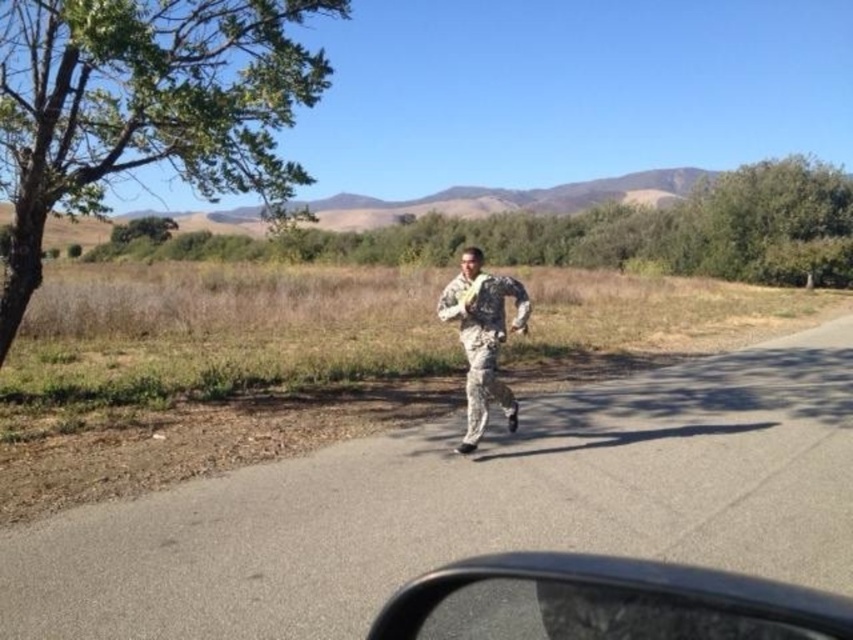
Who is shorter, transparent plastic car window at lower center or camouflage fabric soldier at center?

With less height is transparent plastic car window at lower center.

Between transparent plastic car window at lower center and camouflage fabric soldier at center, which one appears on the right side from the viewer's perspective?

transparent plastic car window at lower center

At what (x,y) coordinates should I click in order to perform the action: click on transparent plastic car window at lower center. Please return your answer as a coordinate pair (x, y). Image resolution: width=853 pixels, height=640 pixels. Looking at the image, I should click on (596, 612).